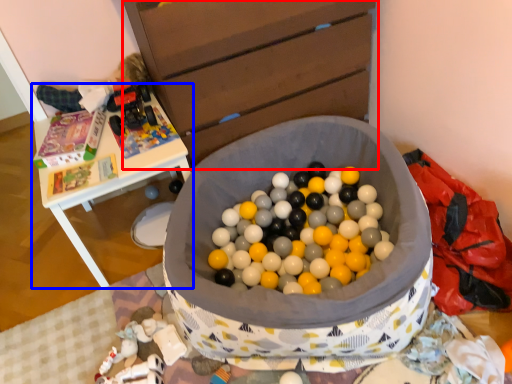
Question: Which point is further to the camera, chest of drawers (highlighted by a red box) or table (highlighted by a blue box)?

Choices:
 (A) chest of drawers
 (B) table

Answer: (B)